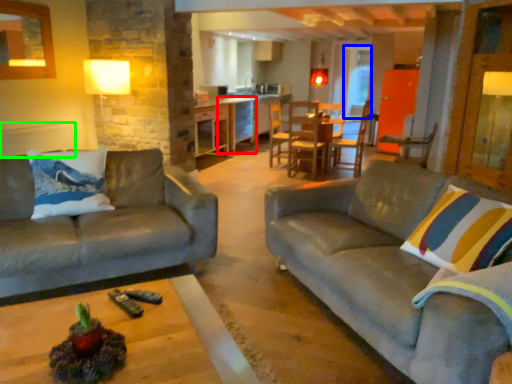
Question: Estimate the real-world distances between objects in this image. Which object is closer to table (highlighted by a red box), glass door (highlighted by a blue box) or radiator (highlighted by a green box)?

Choices:
 (A) glass door
 (B) radiator

Answer: (A)